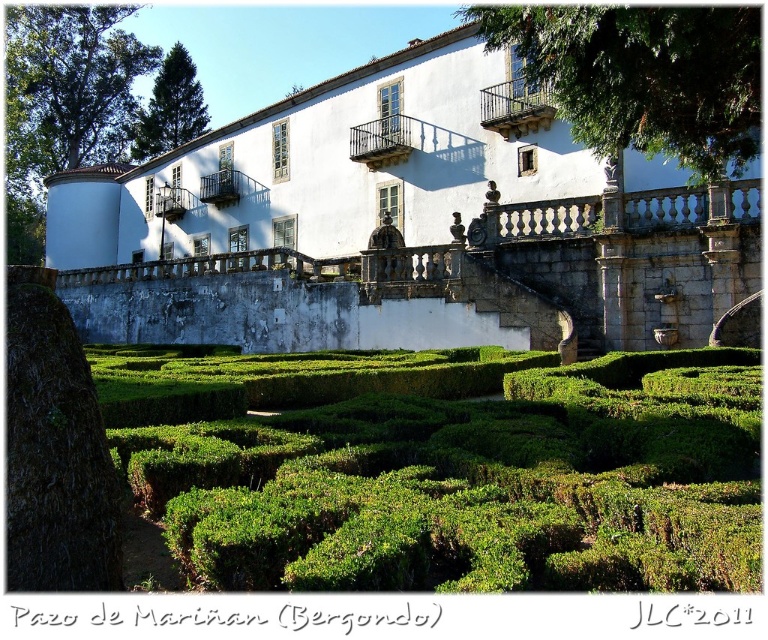
Can you confirm if white stone building at center is positioned to the right of green hedge at center?

No, white stone building at center is not to the right of green hedge at center.

Does white stone building at center have a greater width compared to green hedge at center?

Yes, white stone building at center is wider than green hedge at center.

I want to click on white stone building at center, so click(411, 220).

Between white stone building at center and green leafy tree at upper left, which one has less height?

green leafy tree at upper left is shorter.

Is point (477, 8) positioned behind point (169, 113)?

No.

The width and height of the screenshot is (768, 640). What are the coordinates of `white stone building at center` in the screenshot? It's located at (411, 220).

You are a GUI agent. You are given a task and a screenshot of the screen. Output one action in this format:
    pyautogui.click(x=<x>, y=<y>)
    Task: Click on the white stone building at center
    The height and width of the screenshot is (640, 768).
    Given the screenshot: What is the action you would take?
    pyautogui.click(x=411, y=220)

Does green hedge at center have a larger size compared to green leafy tree at upper left?

Incorrect, green hedge at center is not larger than green leafy tree at upper left.

Between green hedge at center and green leafy tree at upper left, which one has more height?

green leafy tree at upper left

Describe the element at coordinates (458, 472) in the screenshot. Image resolution: width=768 pixels, height=640 pixels. I see `green hedge at center` at that location.

Locate an element on the screen. The height and width of the screenshot is (640, 768). green hedge at center is located at coordinates (458, 472).